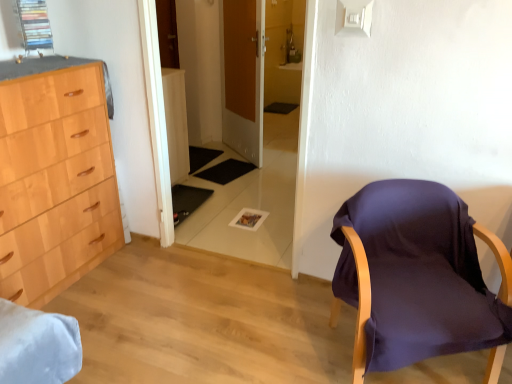
Question: Is wooden door at center smaller than transparent glass door at center?

Choices:
 (A) yes
 (B) no

Answer: (B)

Question: Is the surface of wooden door at center in direct contact with transparent glass door at center?

Choices:
 (A) no
 (B) yes

Answer: (A)

Question: Can you confirm if wooden door at center is thinner than transparent glass door at center?

Choices:
 (A) yes
 (B) no

Answer: (B)

Question: Is wooden door at center positioned with its back to transparent glass door at center?

Choices:
 (A) yes
 (B) no

Answer: (B)

Question: From a real-world perspective, is wooden door at center located beneath transparent glass door at center?

Choices:
 (A) no
 (B) yes

Answer: (A)

Question: From the image's perspective, is purple fabric chair at right positioned above or below transparent glass door at center?

Choices:
 (A) below
 (B) above

Answer: (A)

Question: Considering the positions of purple fabric chair at right and transparent glass door at center in the image, is purple fabric chair at right wider or thinner than transparent glass door at center?

Choices:
 (A) thin
 (B) wide

Answer: (B)

Question: In the image, is purple fabric chair at right positioned in front of or behind transparent glass door at center?

Choices:
 (A) behind
 (B) front

Answer: (B)

Question: Looking at the image, does purple fabric chair at right seem bigger or smaller compared to transparent glass door at center?

Choices:
 (A) small
 (B) big

Answer: (B)

Question: Is point (366, 228) positioned closer to the camera than point (250, 91)?

Choices:
 (A) farther
 (B) closer

Answer: (B)

Question: Is purple fabric chair at right wider or thinner than wooden door at center?

Choices:
 (A) wide
 (B) thin

Answer: (A)

Question: Is purple fabric chair at right taller or shorter than wooden door at center?

Choices:
 (A) short
 (B) tall

Answer: (A)

Question: From a real-world perspective, is purple fabric chair at right positioned above or below wooden door at center?

Choices:
 (A) below
 (B) above

Answer: (A)

Question: In terms of size, does transparent glass door at center appear bigger or smaller than purple fabric chair at right?

Choices:
 (A) small
 (B) big

Answer: (A)

Question: Is transparent glass door at center to the left or to the right of purple fabric chair at right in the image?

Choices:
 (A) right
 (B) left

Answer: (B)